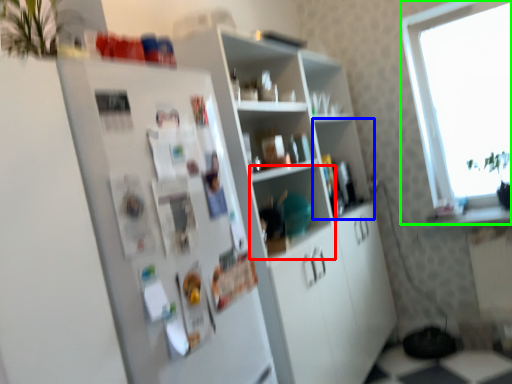
Question: Based on their relative distances, which object is farther from shelf (highlighted by a red box)? Choose from shelf (highlighted by a blue box) and window (highlighted by a green box).

Choices:
 (A) shelf
 (B) window

Answer: (B)